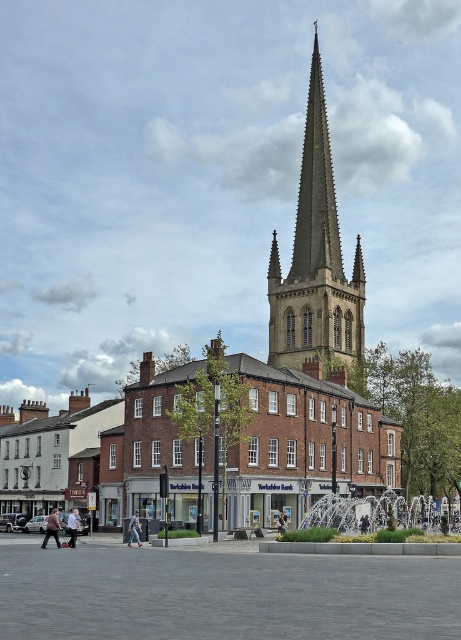
Question: Among these objects, which one is farthest from the camera?

Choices:
 (A) matte pink shirt at center
 (B) denim jacket at lower center
 (C) light brown leather jacket at lower left
 (D) smooth stone spire at center

Answer: (D)

Question: Which point is farther from the camera taking this photo?

Choices:
 (A) (47, 531)
 (B) (71, 544)
 (C) (324, 104)

Answer: (C)

Question: Estimate the real-world distances between objects in this image. Which object is farther from the light brown leather jacket at lower left?

Choices:
 (A) smooth stone spire at center
 (B) denim jacket at lower center

Answer: (A)

Question: Does light brown leather jacket at lower left appear under denim jacket at lower center?

Choices:
 (A) no
 (B) yes

Answer: (B)

Question: Is smooth stone spire at center positioned behind light brown leather jacket at lower left?

Choices:
 (A) no
 (B) yes

Answer: (B)

Question: Can you confirm if smooth stone spire at center is wider than light brown leather jacket at lower left?

Choices:
 (A) yes
 (B) no

Answer: (A)